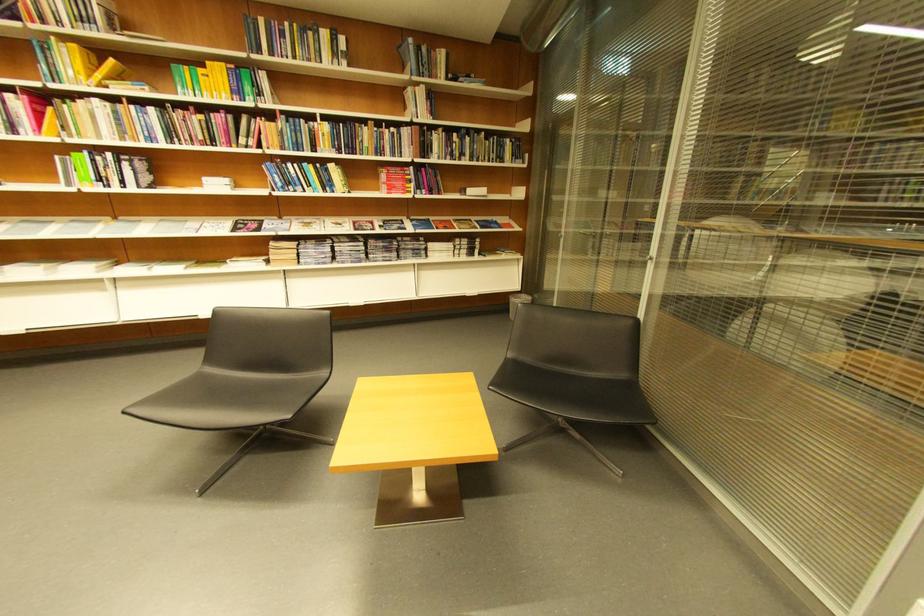
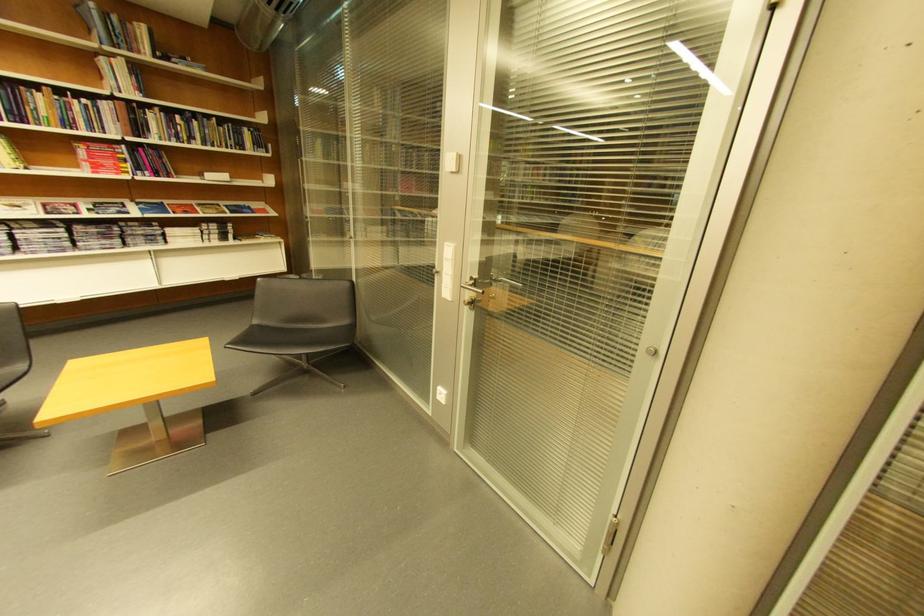
In the second image, find the point that corresponds to [478,140] in the first image.

(205, 124)